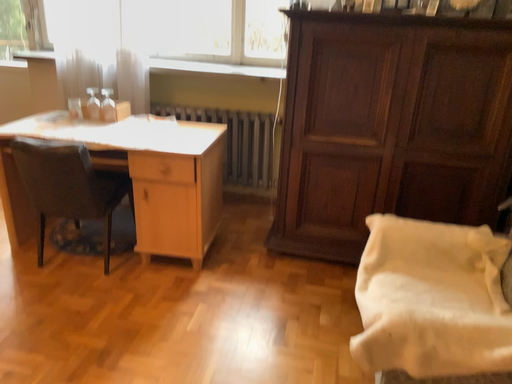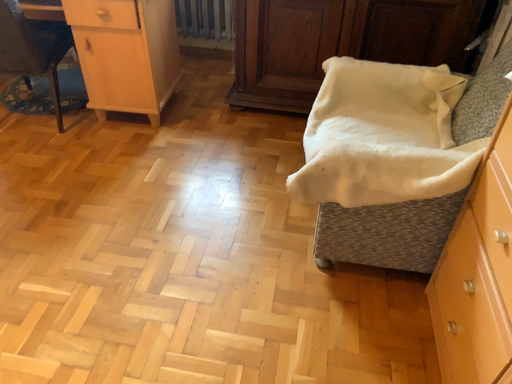
Question: How did the camera likely rotate when shooting the video?

Choices:
 (A) rotated downward
 (B) rotated upward

Answer: (A)